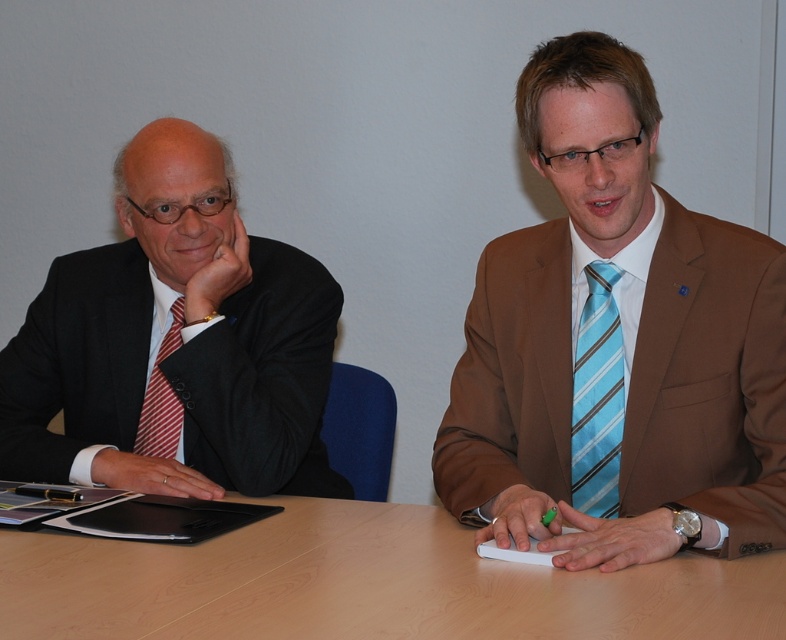
Who is positioned more to the right, brown silk suit at center or light brown wood table at center?

Positioned to the right is brown silk suit at center.

Is brown silk suit at center above light brown wood table at center?

Yes.

Between point (483, 492) and point (643, 579), which one is positioned in front?

Point (643, 579)

Identify the location of brown silk suit at center. (616, 346).

Which is above, light brown wood table at center or red striped tie at left?

red striped tie at left

Based on the photo, can you confirm if light brown wood table at center is taller than red striped tie at left?

Incorrect, light brown wood table at center's height is not larger of red striped tie at left's.

Is point (403, 634) positioned after point (156, 365)?

No, it is not.

Identify the location of light brown wood table at center. (365, 584).

Is matte black suit at left further to camera compared to red striped tie at left?

No.

Is matte black suit at left bigger than red striped tie at left?

Yes, matte black suit at left is bigger than red striped tie at left.

This screenshot has height=640, width=786. In order to click on matte black suit at left in this screenshot , I will do `click(175, 342)`.

Locate an element on the screen. The width and height of the screenshot is (786, 640). matte black suit at left is located at coordinates [175, 342].